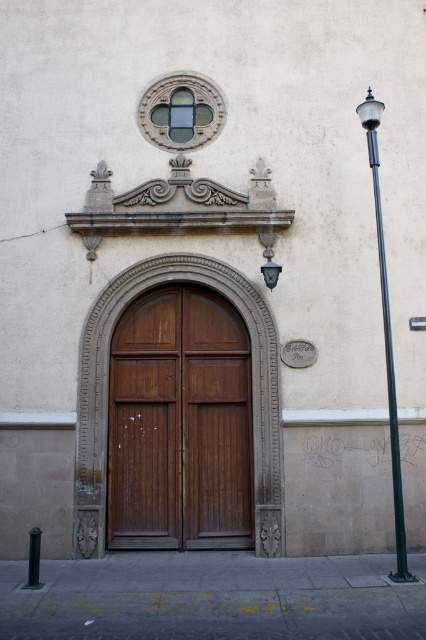
Question: Is wooden door at center below black metal pole at right?

Choices:
 (A) yes
 (B) no

Answer: (A)

Question: Is wooden door at center thinner than black metal pole at right?

Choices:
 (A) no
 (B) yes

Answer: (A)

Question: Which point appears closest to the camera in this image?

Choices:
 (A) (393, 432)
 (B) (207, 480)

Answer: (A)

Question: Which object is farther from the camera taking this photo?

Choices:
 (A) black metal pole at right
 (B) wooden door at center

Answer: (B)

Question: Which point is closer to the camera?

Choices:
 (A) black metal pole at right
 (B) wooden door at center

Answer: (A)

Question: Can you confirm if wooden door at center is thinner than black metal pole at right?

Choices:
 (A) no
 (B) yes

Answer: (A)